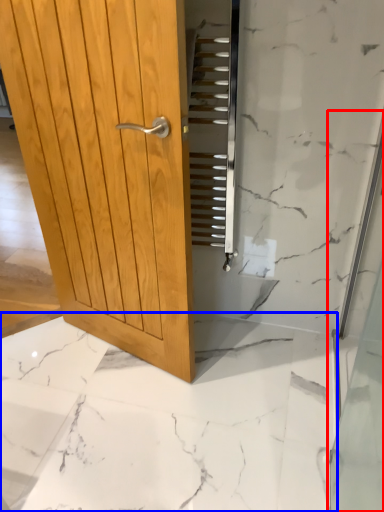
Question: Which object is further to the camera taking this photo, shower door (highlighted by a red box) or granite (highlighted by a blue box)?

Choices:
 (A) shower door
 (B) granite

Answer: (B)